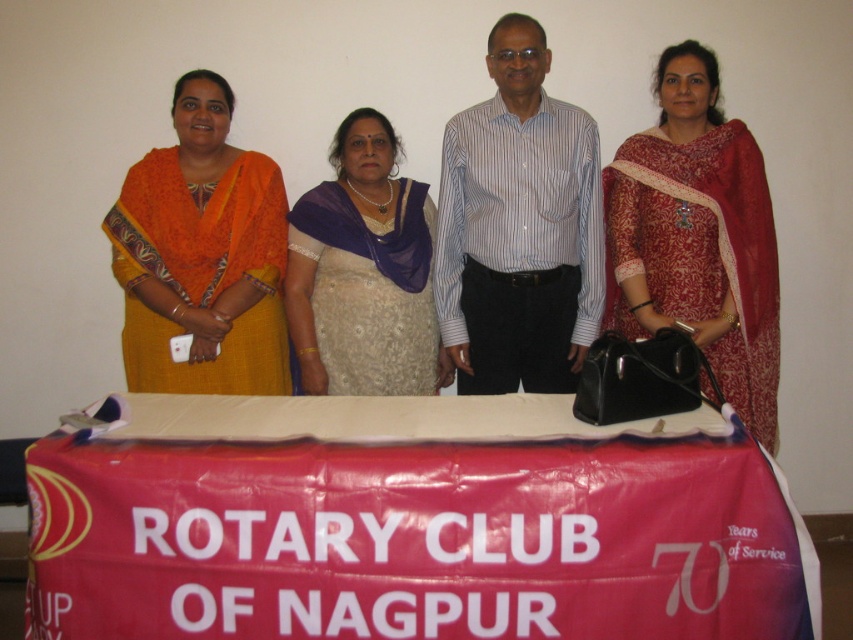
Question: Which of the following is the closest to the observer?

Choices:
 (A) (775, 312)
 (B) (300, 204)

Answer: (A)

Question: Does blue striped shirt at center lie in front of matte red saree at right?

Choices:
 (A) yes
 (B) no

Answer: (A)

Question: Which is nearer to the matte red saree at right?

Choices:
 (A) red fabric banner at center
 (B) blue striped shirt at center
 (C) beige embroidered saree at center

Answer: (B)

Question: Which object is farther from the camera taking this photo?

Choices:
 (A) beige embroidered saree at center
 (B) red fabric banner at center

Answer: (A)

Question: Is blue striped shirt at center in front of beige embroidered saree at center?

Choices:
 (A) no
 (B) yes

Answer: (B)

Question: Does blue striped shirt at center appear on the right side of matte red saree at right?

Choices:
 (A) yes
 (B) no

Answer: (B)